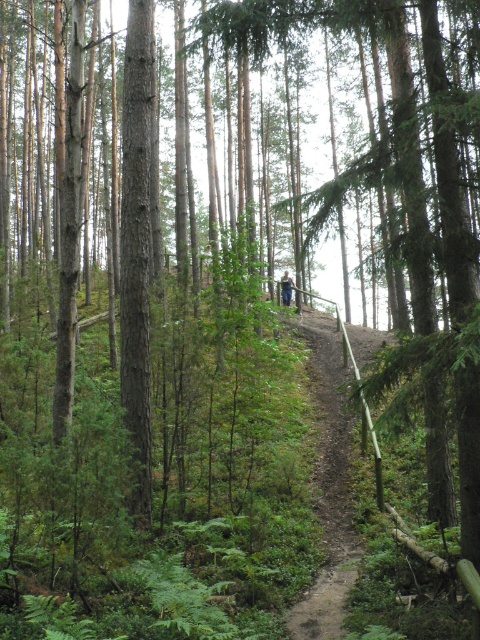
You are a hiker standing at the wooden railing on the dirt path in the forest. You see two points marked on the ground ahead of you, one at point coordinates point (324, 451) and the other at point (286, 305). Which point is closer to your current position?

Point (324, 451) is closer to the camera than point (286, 305), so the point at coordinates point (324, 451) is closer to your current position.

You are a hiker trying to follow the dirt path at center and the blue jeans at center. Which one is wider?

The dirt path at center is bigger than blue jeans at center, so the dirt path at center is wider.